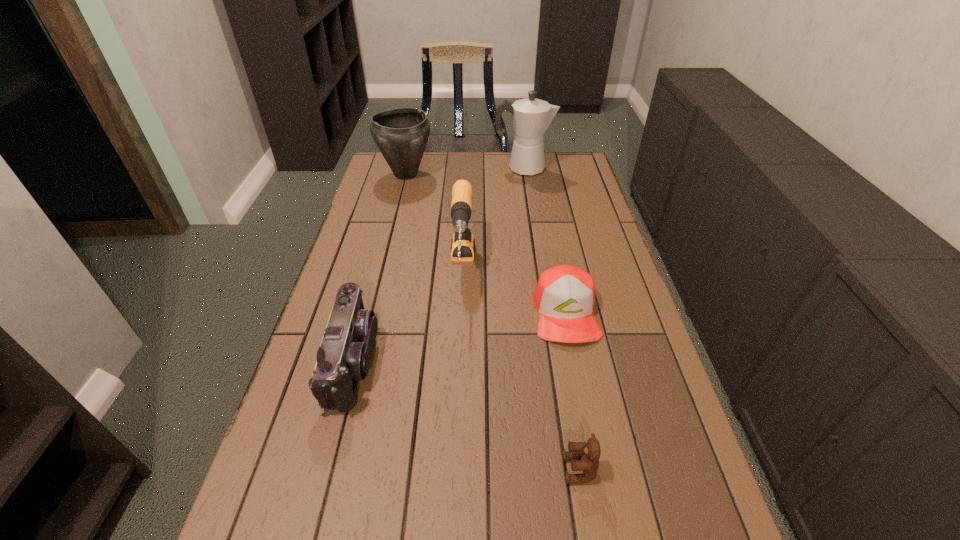
Identify the location of object at the far left corner. (401, 134).

This screenshot has height=540, width=960. What are the coordinates of `object present at the far right corner` in the screenshot? It's located at (531, 117).

Locate an element on the screen. The width and height of the screenshot is (960, 540). free space at the far edge of the desktop is located at coordinates (482, 170).

Where is `vacant space at the left edge`? vacant space at the left edge is located at coordinates (379, 215).

In the image, there is a desktop. At what (x,y) coordinates should I click in order to perform the action: click on vacant space at the right edge. Please return your answer as a coordinate pair (x, y). This screenshot has width=960, height=540. Looking at the image, I should click on (622, 402).

This screenshot has height=540, width=960. Find the location of `vacant space at the far right corner of the desktop`. vacant space at the far right corner of the desktop is located at coordinates (548, 180).

Locate an element on the screen. This screenshot has height=540, width=960. free space between the nearest object and the urn is located at coordinates (492, 322).

Image resolution: width=960 pixels, height=540 pixels. I want to click on free spot between the urn and the tallest object, so click(465, 171).

The image size is (960, 540). In order to click on blank region between the baseball cap and the third object from left to right in this screenshot , I will do `click(514, 290)`.

Locate an element on the screen. The width and height of the screenshot is (960, 540). free space that is in between the drill and the coffeepot is located at coordinates (492, 218).